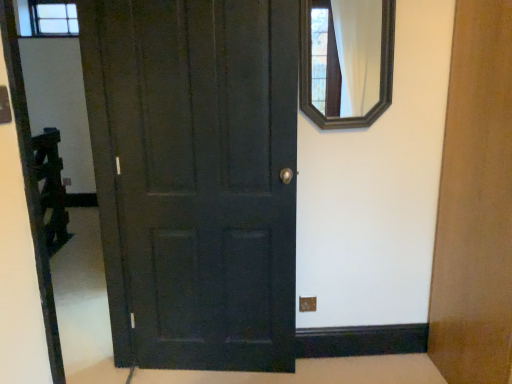
Where is `free region under matte dark wood door at center (from a real-world perspective)`? Image resolution: width=512 pixels, height=384 pixels. free region under matte dark wood door at center (from a real-world perspective) is located at coordinates (231, 369).